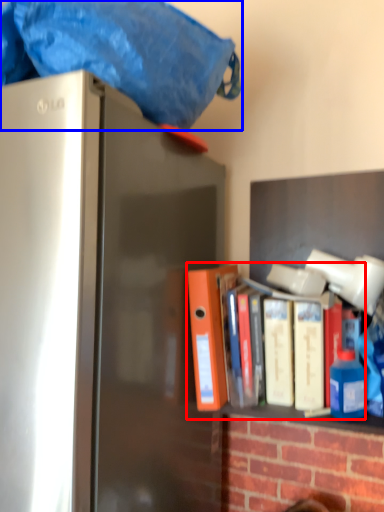
Question: Which object appears closest to the camera in this image, book (highlighted by a red box) or blanket (highlighted by a blue box)?

Choices:
 (A) book
 (B) blanket

Answer: (B)